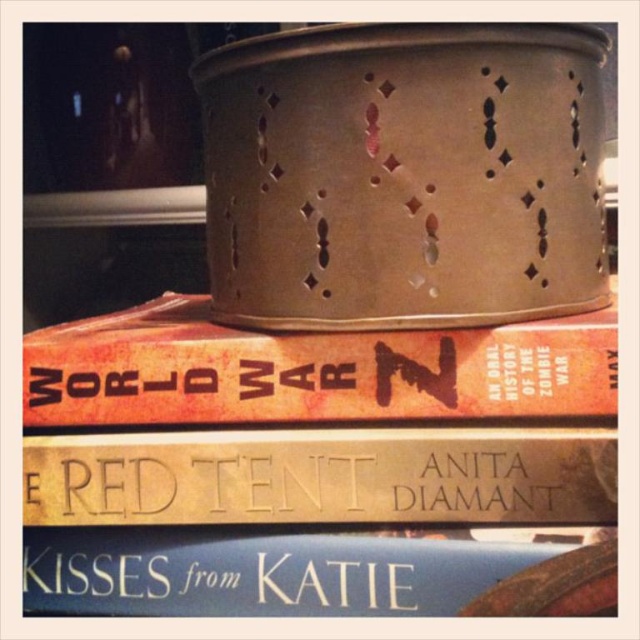
You are organizing a bookshelf and need to place the orange matte hardcover book at center and the gold embossed book at center. Which book should you place first to ensure stability?

You should place the orange matte hardcover book at center first because it is bigger than the gold embossed book at center, providing a stable base for the smaller book to rest on top.

You are standing in front of the stack of books and want to reach the point labeled as point (225, 499). Is this point closer to you than the point labeled as point (22, 552)?

Yes, the point labeled as point (225, 499) is closer to you because it is in front of the point labeled as point (22, 552).

You are organizing a library shelf and need to place the gold embossed book at center and the blue matte book at lower center. According to the image, which book should be placed higher on the shelf?

The gold embossed book at center should be placed higher on the shelf because it is positioned above the blue matte book at lower center in the image.